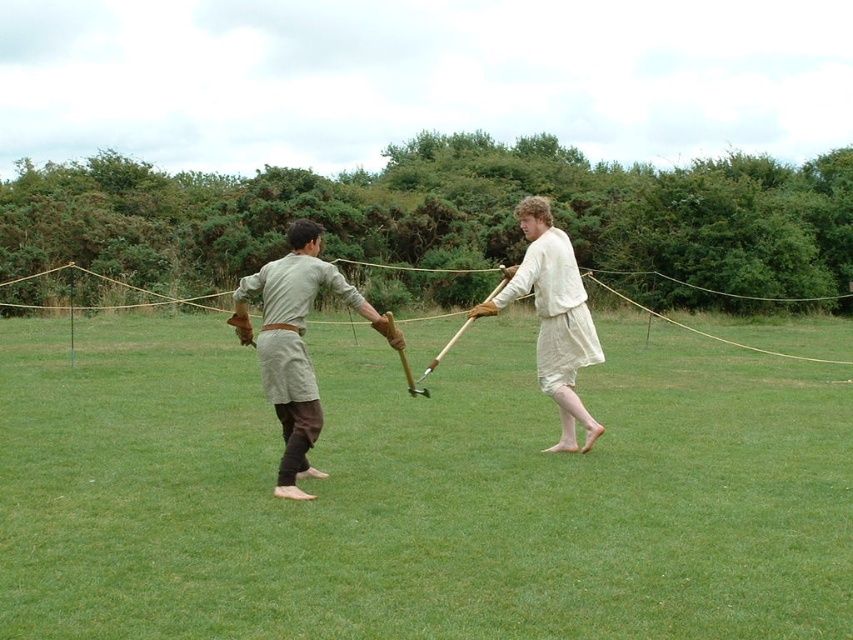
Where is `light beige fabric shirt at center`? light beige fabric shirt at center is located at coordinates (294, 342).

Based on the photo, is light beige fabric shirt at center positioned in front of light beige linen shorts at center?

Yes, it is.

You are a GUI agent. You are given a task and a screenshot of the screen. Output one action in this format:
    pyautogui.click(x=<x>, y=<y>)
    Task: Click on the light beige fabric shirt at center
    The width and height of the screenshot is (853, 640).
    Given the screenshot: What is the action you would take?
    pyautogui.click(x=294, y=342)

Is light beige fabric sword at center smaller than light beige linen shorts at center?

No, light beige fabric sword at center is not smaller than light beige linen shorts at center.

Who is more forward, (280,394) or (498,307)?

Point (280,394)

The image size is (853, 640). What do you see at coordinates (294, 346) in the screenshot?
I see `light beige fabric sword at center` at bounding box center [294, 346].

At what (x,y) coordinates should I click in order to perform the action: click on light beige fabric sword at center. Please return your answer as a coordinate pair (x, y). Looking at the image, I should click on (294, 346).

Is point (136, 445) behind point (310, 256)?

Yes, point (136, 445) is behind point (310, 256).

This screenshot has width=853, height=640. In order to click on green grass at center in this screenshot , I will do `click(418, 492)`.

Locate an element on the screen. This screenshot has height=640, width=853. green grass at center is located at coordinates (418, 492).